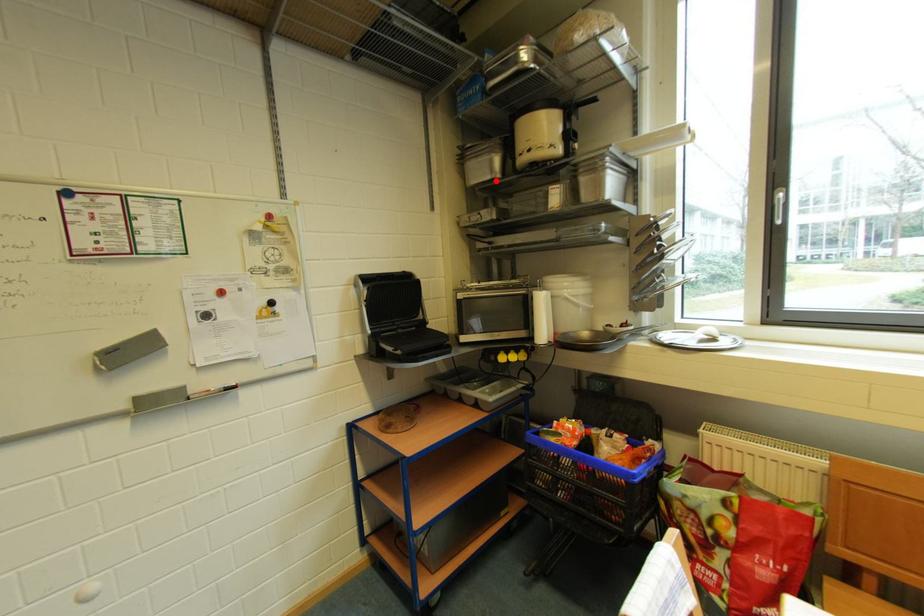
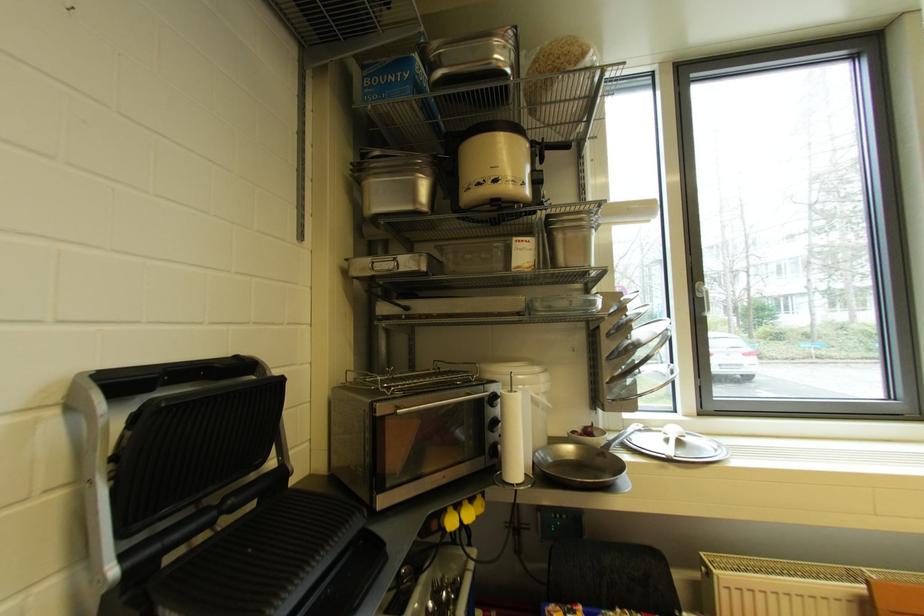
Where in the second image is the point corresponding to the highlighted location from the first image?

(418, 211)